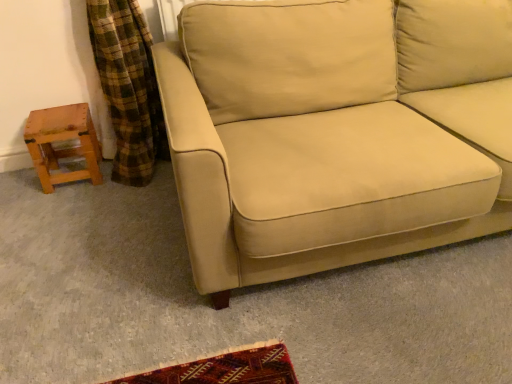
The width and height of the screenshot is (512, 384). What are the coordinates of `vacant region above wooden stool at left (from a real-world perspective)` in the screenshot? It's located at (56, 114).